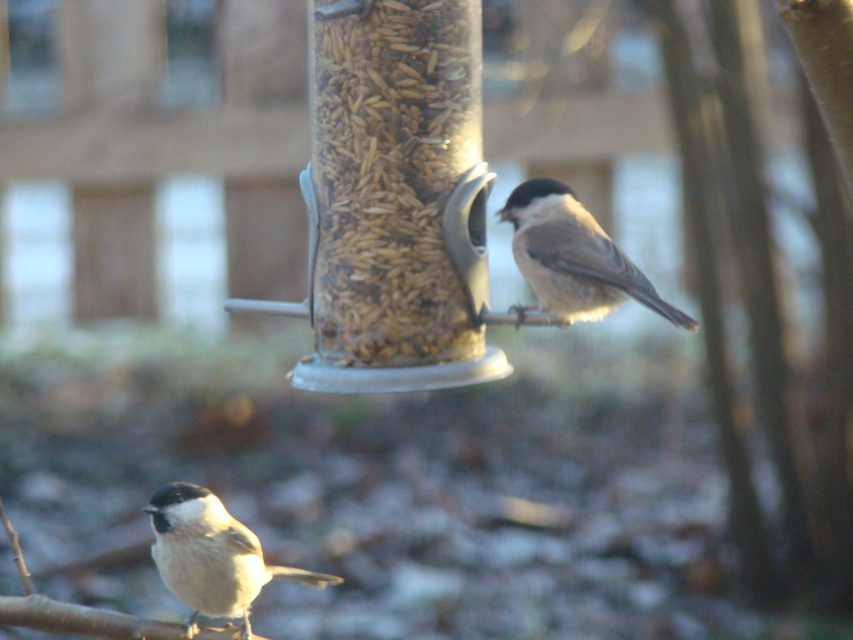
Question: Does soft gray feathers at upper right have a larger size compared to soft gray feathers at lower left?

Choices:
 (A) no
 (B) yes

Answer: (A)

Question: Is soft gray feathers at upper right smaller than soft gray feathers at lower left?

Choices:
 (A) yes
 (B) no

Answer: (A)

Question: Among these points, which one is farthest from the camera?

Choices:
 (A) (347, 99)
 (B) (181, 490)
 (C) (541, 198)

Answer: (B)

Question: Estimate the real-world distances between objects in this image. Which object is closer to the soft gray feathers at lower left?

Choices:
 (A) brown grain at center
 (B) soft gray feathers at upper right

Answer: (A)

Question: Which point appears closest to the camera in this image?

Choices:
 (A) (556, 269)
 (B) (322, 320)
 (C) (234, 577)

Answer: (A)

Question: Can you confirm if brown grain at center is positioned below soft gray feathers at upper right?

Choices:
 (A) yes
 (B) no

Answer: (B)